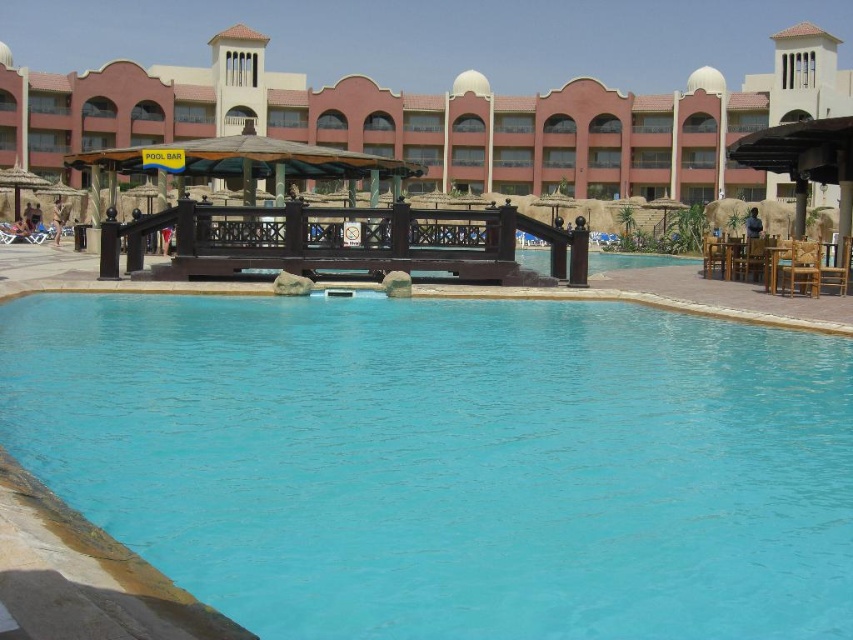
Question: In this image, where is blue smooth water at center located relative to brown wooden gazebo at center?

Choices:
 (A) left
 (B) right

Answer: (A)

Question: Which object appears closest to the camera in this image?

Choices:
 (A) brown wooden gazebo at center
 (B) blue smooth water at center

Answer: (B)

Question: Which object is closer to the camera taking this photo?

Choices:
 (A) blue smooth water at center
 (B) brown wooden gazebo at center

Answer: (A)

Question: Can you confirm if blue smooth water at center is positioned above brown wooden gazebo at center?

Choices:
 (A) no
 (B) yes

Answer: (A)

Question: Does blue smooth water at center have a greater width compared to brown wooden gazebo at center?

Choices:
 (A) yes
 (B) no

Answer: (B)